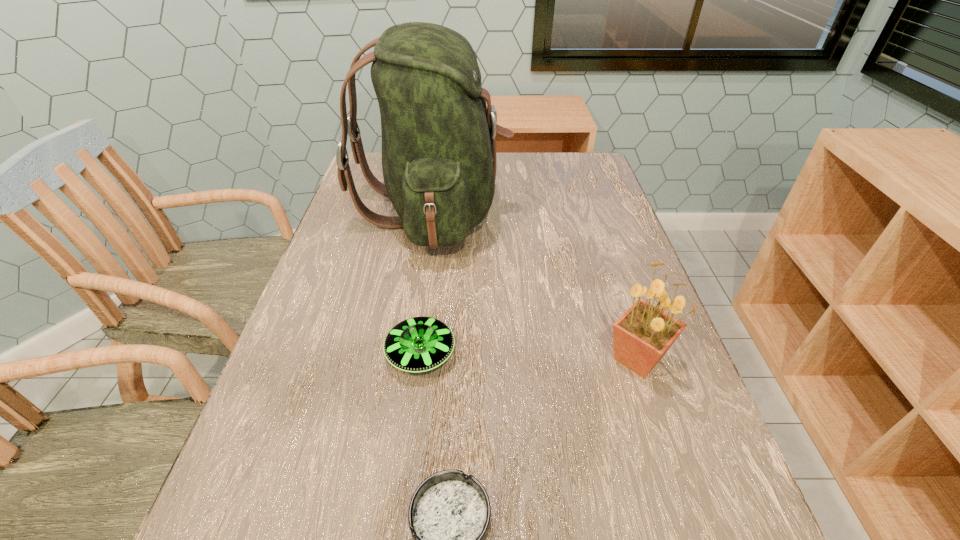
This screenshot has width=960, height=540. Find the location of `object that is at the right edge`. object that is at the right edge is located at coordinates (644, 333).

Where is `object that is at the far left corner`? object that is at the far left corner is located at coordinates (439, 162).

Image resolution: width=960 pixels, height=540 pixels. Identify the location of free space at the left edge of the desktop. (309, 366).

This screenshot has height=540, width=960. In the image, there is a desktop. In order to click on free space at the right edge in this screenshot , I will do `click(608, 305)`.

Image resolution: width=960 pixels, height=540 pixels. I want to click on free space at the far right corner of the desktop, so click(592, 168).

At what (x,y) coordinates should I click in order to perform the action: click on vacant area that lies between the saucer and the backpack. Please return your answer as a coordinate pair (x, y). The image size is (960, 540). Looking at the image, I should click on (427, 283).

The image size is (960, 540). I want to click on free spot between the second shortest object and the sunflower, so click(529, 356).

Find the location of `vacant space that is in between the sunflower and the backpack`. vacant space that is in between the sunflower and the backpack is located at coordinates click(536, 285).

The image size is (960, 540). I want to click on free space between the saucer and the rightmost object, so point(529,356).

Locate an element on the screen. This screenshot has height=540, width=960. the closest object to the nearest object is located at coordinates (418, 344).